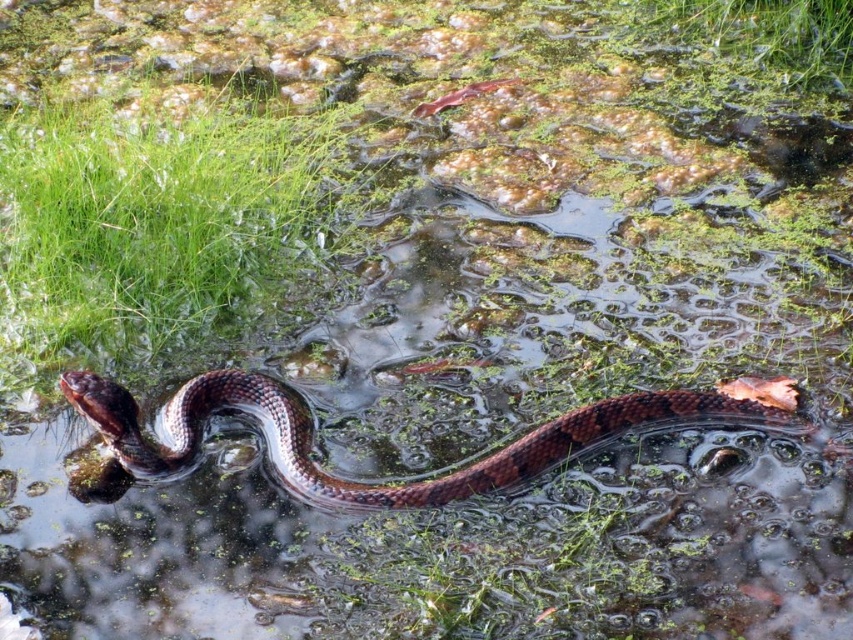
You are a wildlife photographer aiming to capture a closeup of the shiny brown snake at center without disturbing the green matte grass at upper center. Given that your camera lens has a minimum focusing distance of 5 feet, will you be able to take the photo from your current position?

The shiny brown snake at center and green matte grass at upper center are 6.11 feet apart. Since the minimum focusing distance is 5 feet, you can take the photo as you are 1.11 feet beyond the minimum requirement.

You are a wildlife photographer aiming to capture a closeup of the shiny brown snake at center without disturbing the green matte grass at upper center. Based on their positions, can you tell if the snake is positioned under the grass?

The shiny brown snake at center is located below green matte grass at upper center, so yes, the snake is positioned under the grass.